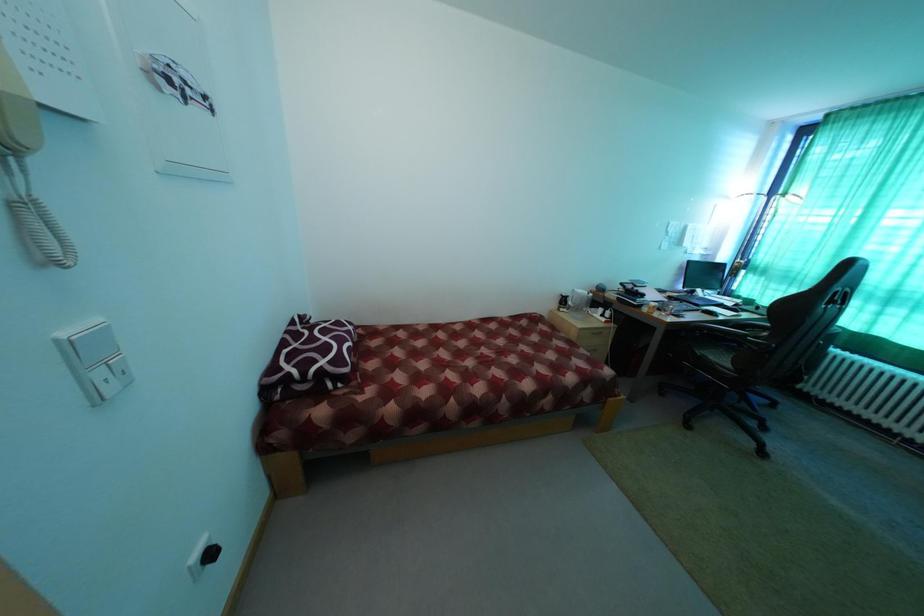
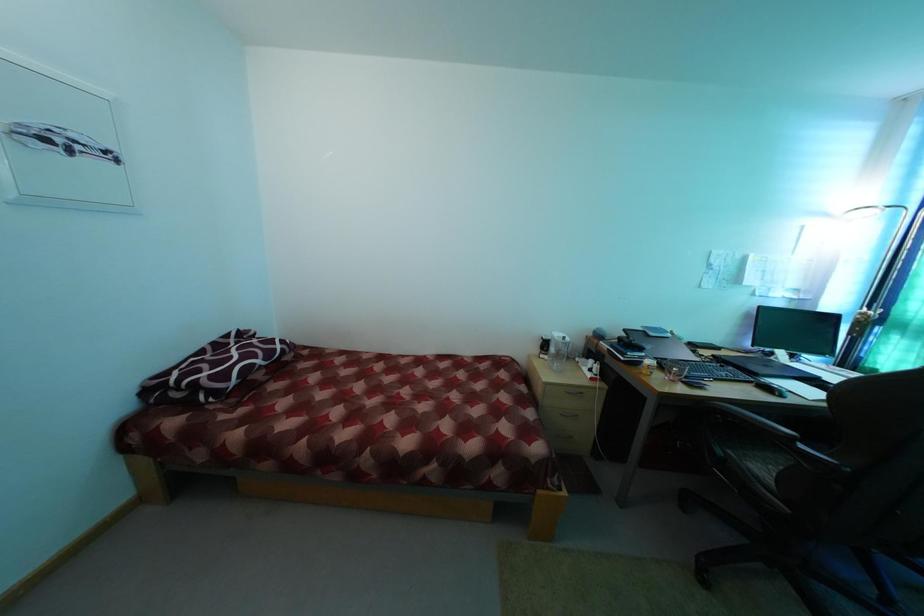
Question: The images are taken continuously from a first-person perspective. In which direction is your viewpoint rotating?

Choices:
 (A) Left
 (B) Right
 (C) Up
 (D) Down

Answer: (A)